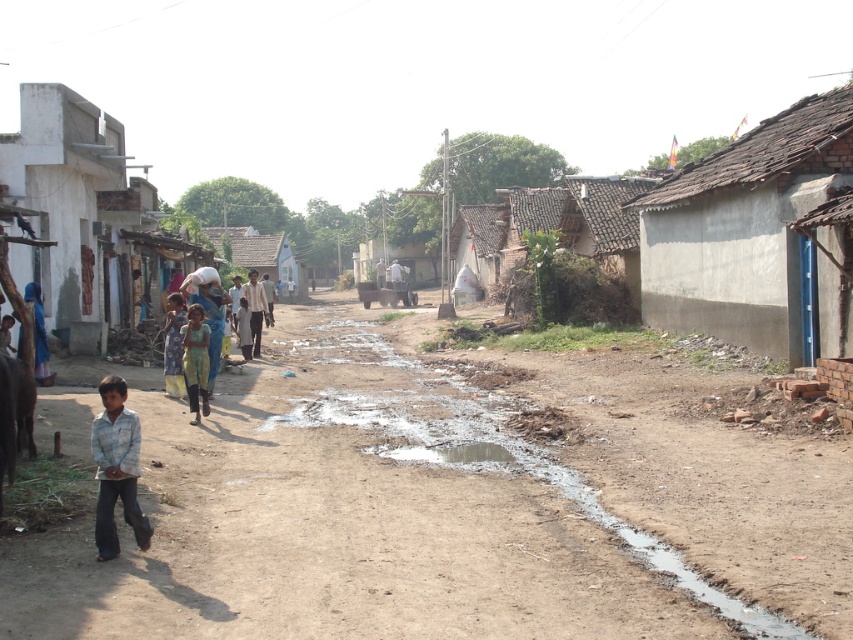
Question: Which point is farther to the camera?

Choices:
 (A) (453, 451)
 (B) (126, 248)
 (C) (190, 342)
 (D) (263, 237)

Answer: (D)

Question: Where is gray concrete hut at right located in relation to muddy water at center in the image?

Choices:
 (A) left
 (B) right

Answer: (B)

Question: Which object is positioned closest to the brown/dry dirt field at lower left?

Choices:
 (A) gray concrete hut at right
 (B) white painted mud hut at upper left
 (C) blue fabric bag at center

Answer: (C)

Question: Can you confirm if white painted mud hut at upper left is positioned to the right of blue fabric bag at center?

Choices:
 (A) no
 (B) yes

Answer: (A)

Question: Is gray concrete hut at right to the left of muddy water at center from the viewer's perspective?

Choices:
 (A) yes
 (B) no

Answer: (B)

Question: Which point is closer to the camera?

Choices:
 (A) (289, 294)
 (B) (144, 288)

Answer: (B)